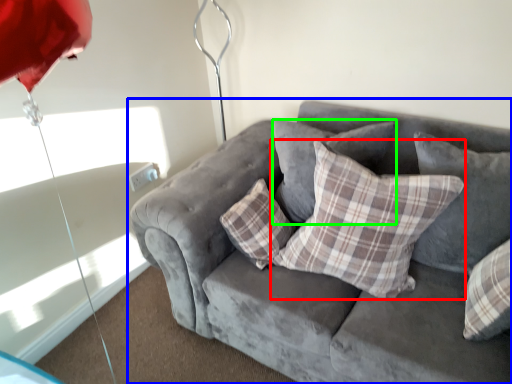
Question: Which object is positioned farthest from pillow (highlighted by a red box)? Select from studio couch (highlighted by a blue box) and pillow (highlighted by a green box).

Choices:
 (A) studio couch
 (B) pillow

Answer: (B)